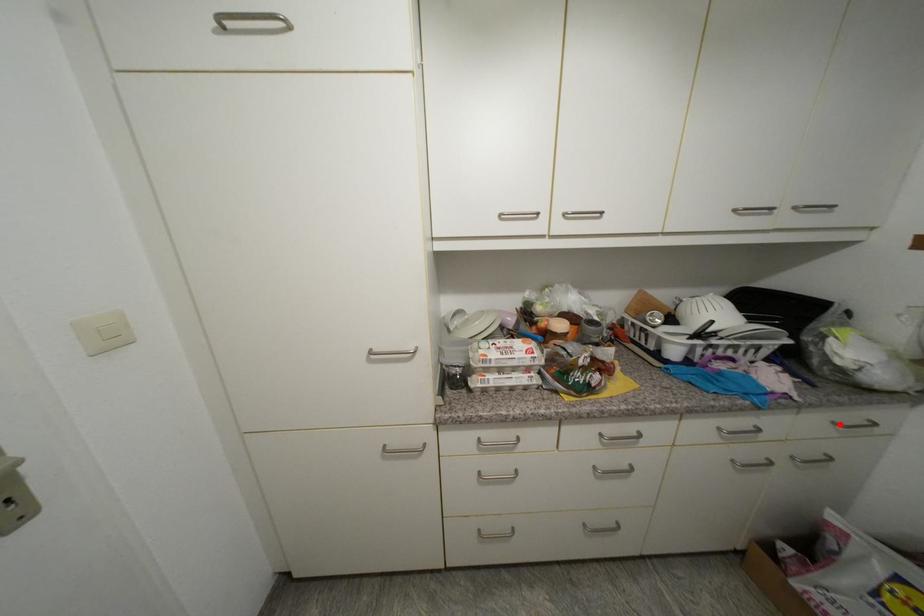
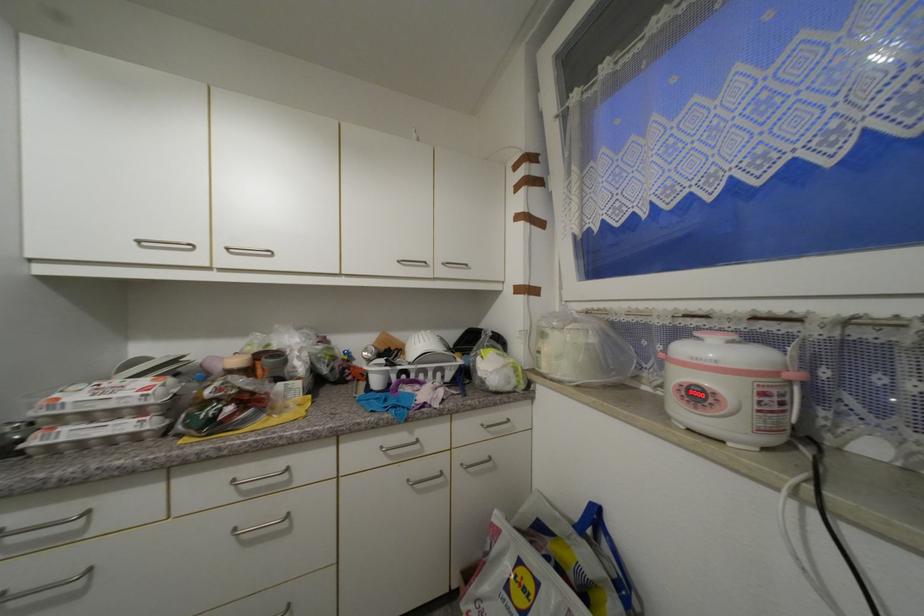
The point at the highlighted location is marked in the first image. Where is the corresponding point in the second image?

(488, 427)